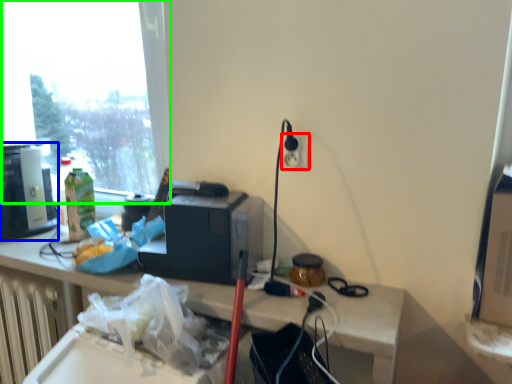
Question: Which object is positioned farthest from electric outlet (highlighted by a red box)? Select from coffee machine (highlighted by a blue box) and window (highlighted by a green box).

Choices:
 (A) coffee machine
 (B) window

Answer: (B)